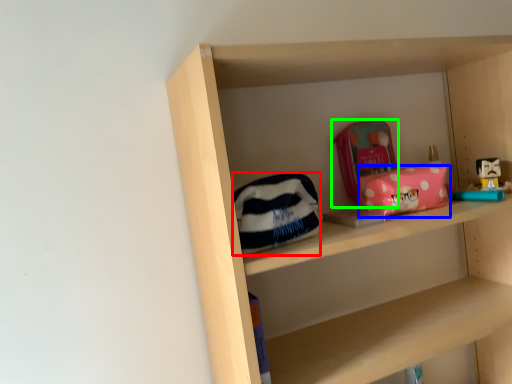
Question: Estimate the real-world distances between objects in this image. Which object is farther from pouch (highlighted by a red box), package (highlighted by a blue box) or pouch (highlighted by a green box)?

Choices:
 (A) package
 (B) pouch

Answer: (B)